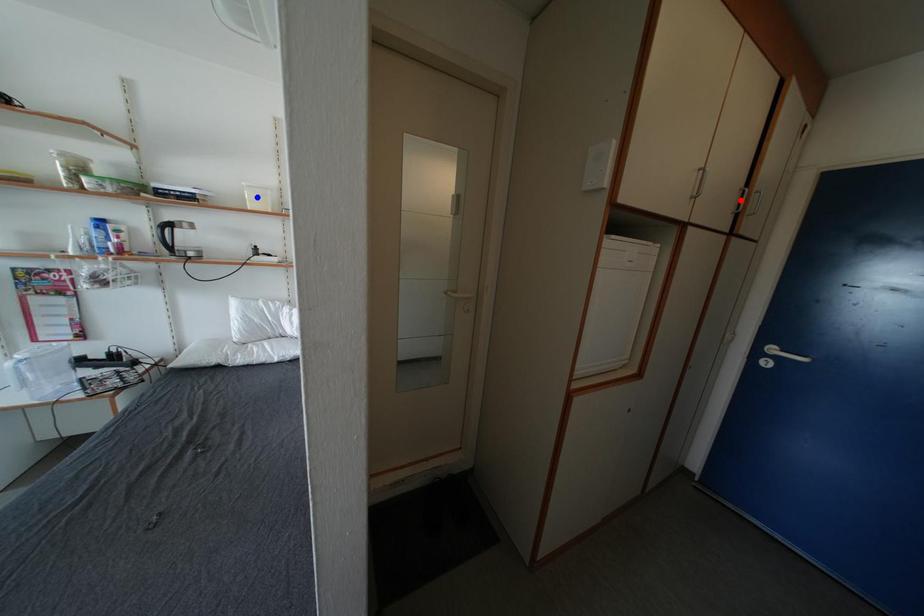
Question: Which of the two points in the image is closer to the camera?

Choices:
 (A) Blue point is closer.
 (B) Red point is closer.

Answer: (B)